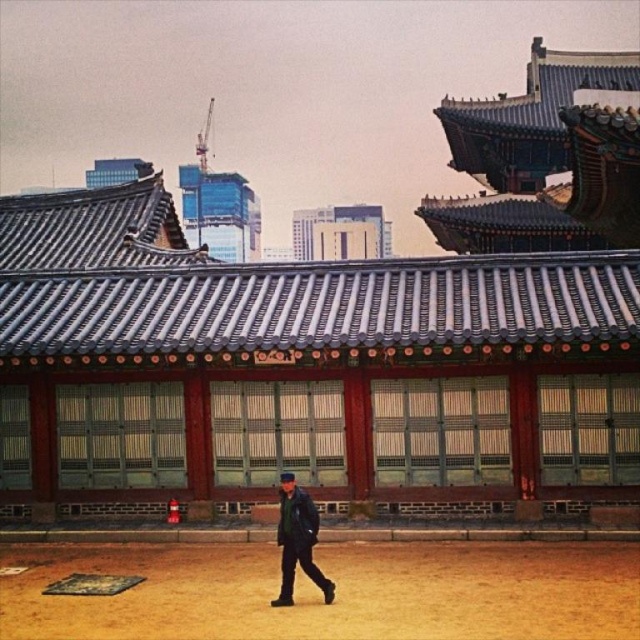
The width and height of the screenshot is (640, 640). What do you see at coordinates (337, 592) in the screenshot? I see `brown sandy ground at center` at bounding box center [337, 592].

Does brown sandy ground at center have a larger size compared to white concrete building at center?

Incorrect, brown sandy ground at center is not larger than white concrete building at center.

Image resolution: width=640 pixels, height=640 pixels. Describe the element at coordinates (337, 592) in the screenshot. I see `brown sandy ground at center` at that location.

Locate an element on the screen. The image size is (640, 640). brown sandy ground at center is located at coordinates (337, 592).

Does point (298, 497) lie in front of point (326, 214)?

Yes, point (298, 497) is in front of point (326, 214).

In order to click on dark blue leather jacket at lower center in this screenshot , I will do `click(298, 540)`.

Can you confirm if brown sandy ground at center is positioned below dark blue leather jacket at lower center?

Yes, brown sandy ground at center is below dark blue leather jacket at lower center.

Between point (152, 637) and point (296, 502), which one is positioned behind?

Point (296, 502)

Locate an element on the screen. brown sandy ground at center is located at coordinates (337, 592).